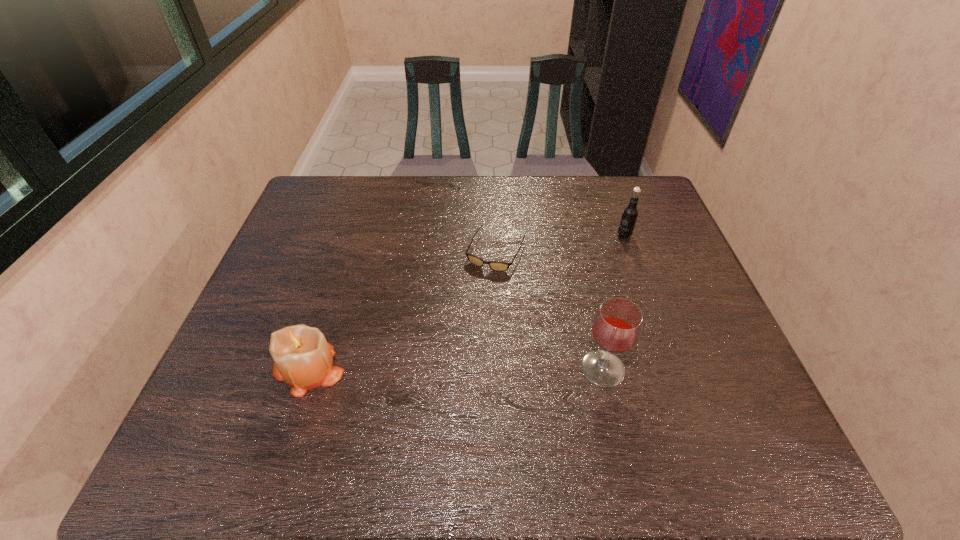
What are the coordinates of `free location located on the label of the root beer` in the screenshot? It's located at (581, 281).

This screenshot has width=960, height=540. Identify the location of free space located 0.340m on the label of the root beer. (559, 305).

The width and height of the screenshot is (960, 540). I want to click on vacant space located on the label of the root beer, so click(581, 281).

The height and width of the screenshot is (540, 960). I want to click on candle located at the near edge, so click(303, 358).

Where is `wineglass present at the near edge`? wineglass present at the near edge is located at coordinates 616,328.

Locate an element on the screen. Image resolution: width=960 pixels, height=540 pixels. object present at the left edge is located at coordinates (303, 358).

Locate an element on the screen. This screenshot has width=960, height=540. object at the right edge is located at coordinates (629, 216).

I want to click on object located in the near left corner section of the desktop, so click(303, 358).

The height and width of the screenshot is (540, 960). What are the coordinates of `free region at the far edge` in the screenshot? It's located at (502, 194).

Image resolution: width=960 pixels, height=540 pixels. I want to click on vacant space at the near edge, so pos(564,409).